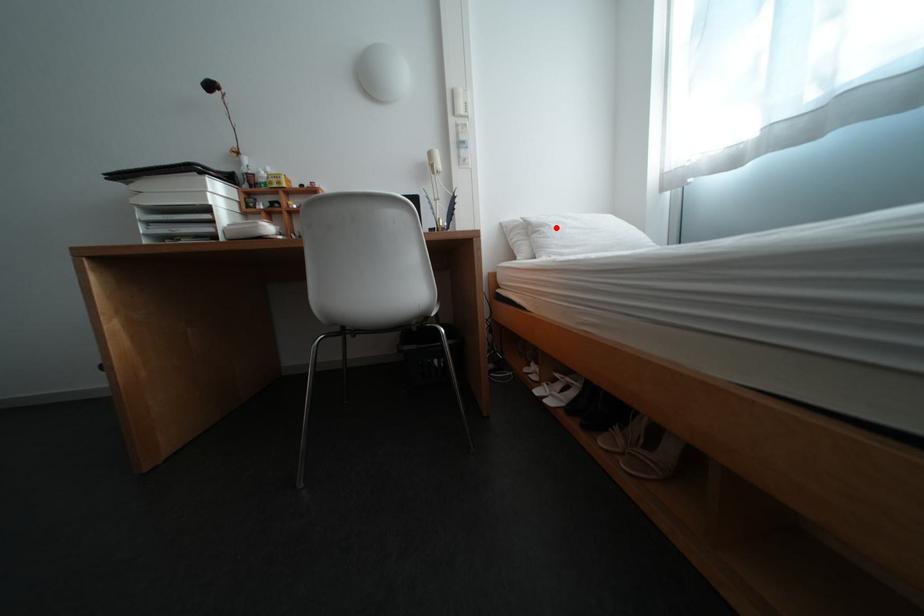
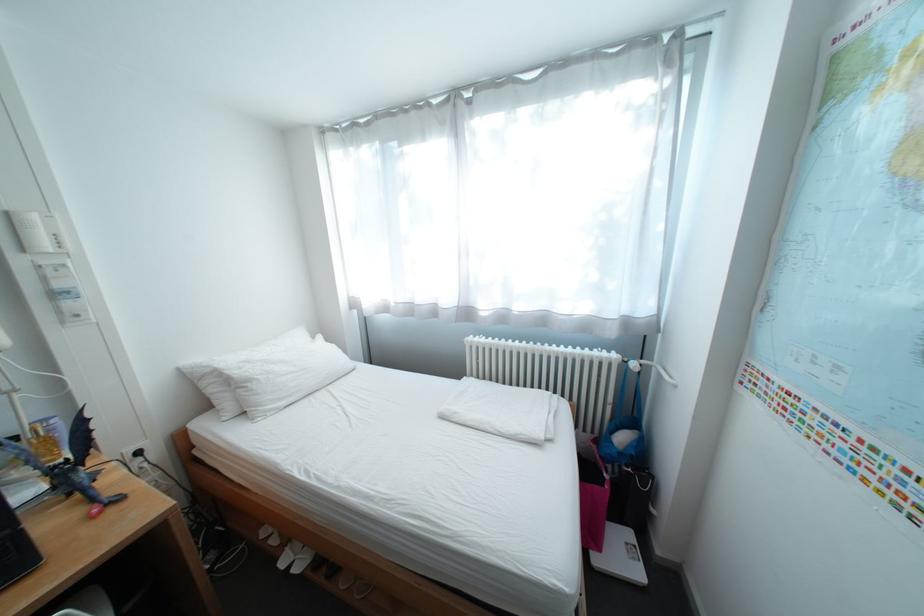
Question: I am providing you with two images of the same scene from different viewpoints. Image1 has a red point marked. In image2, the corresponding 3D location appears at what relative position? Reply with the corresponding letter.

Choices:
 (A) Closer
 (B) Farther

Answer: (B)